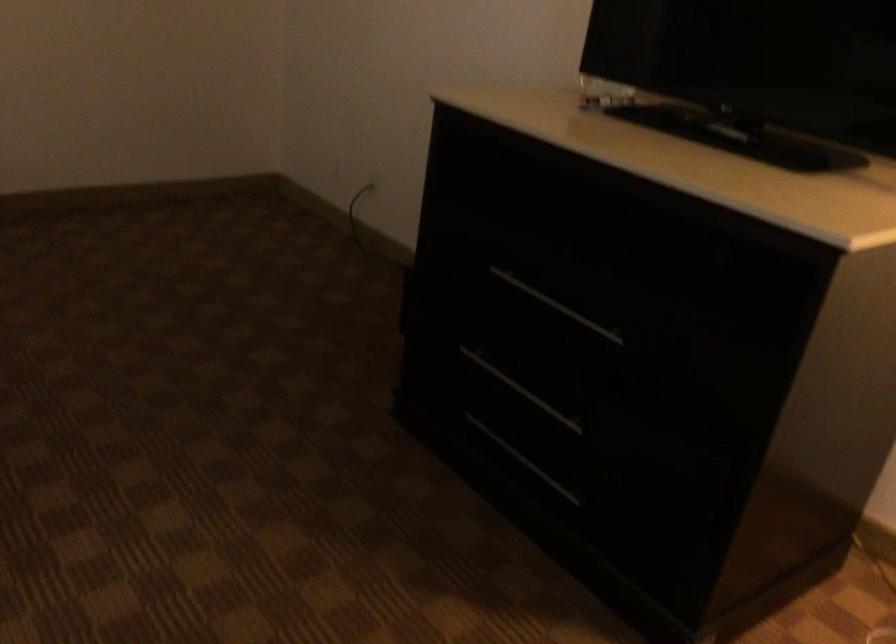
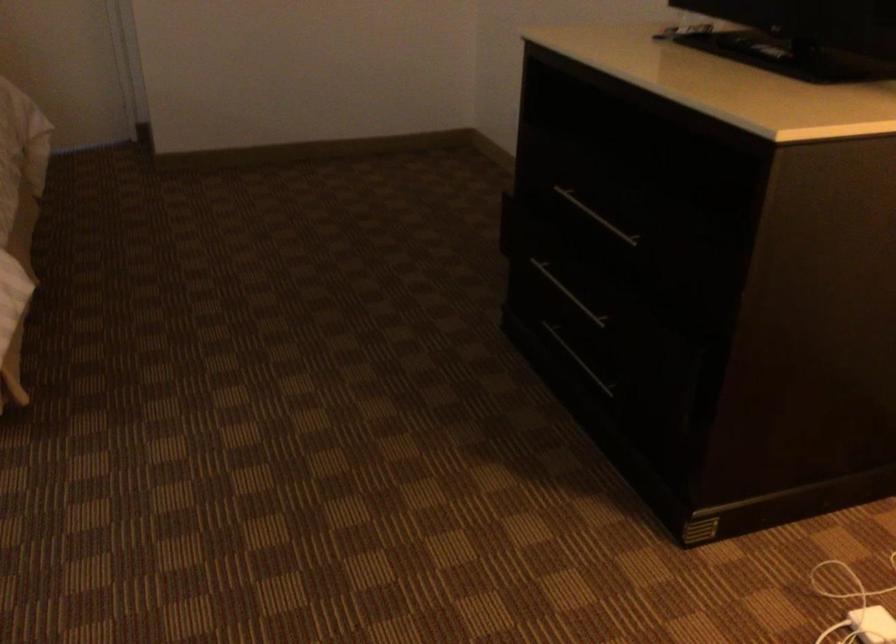
Question: The images are taken continuously from a first-person perspective. In which direction is your viewpoint rotating?

Choices:
 (A) Left
 (B) Right
 (C) Up
 (D) Down

Answer: (A)